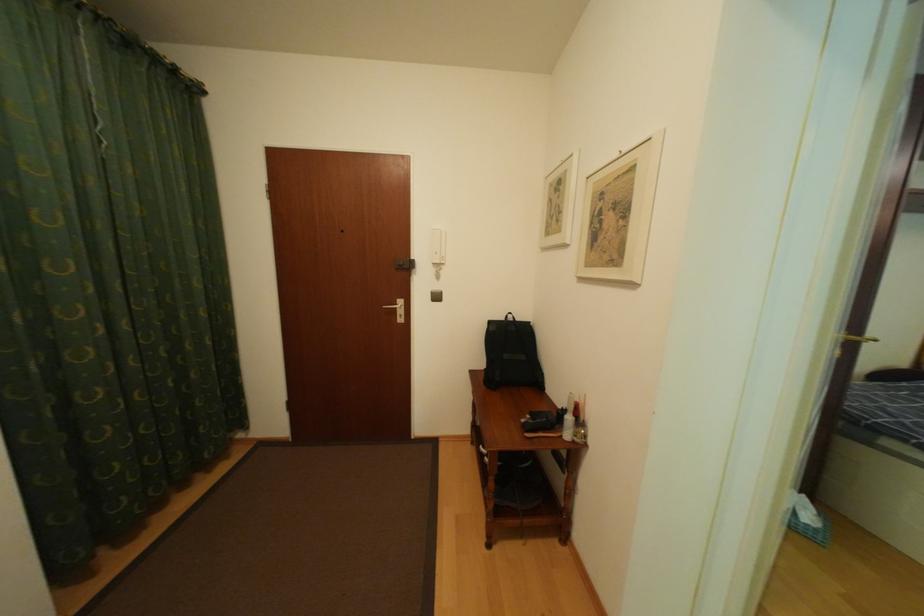
Find where to pull the silver door handle. Please return your answer as a coordinate pair (x, y).

(395, 304)